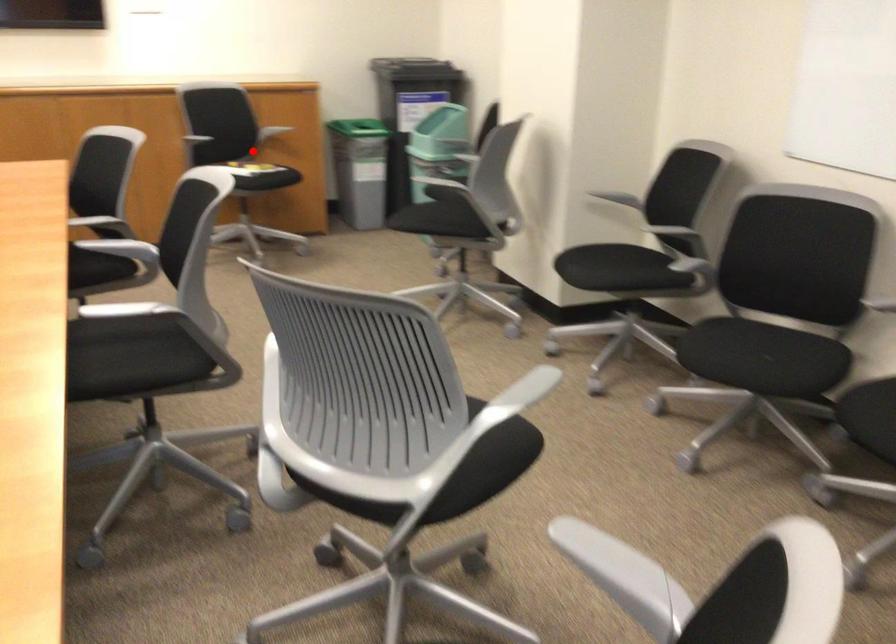
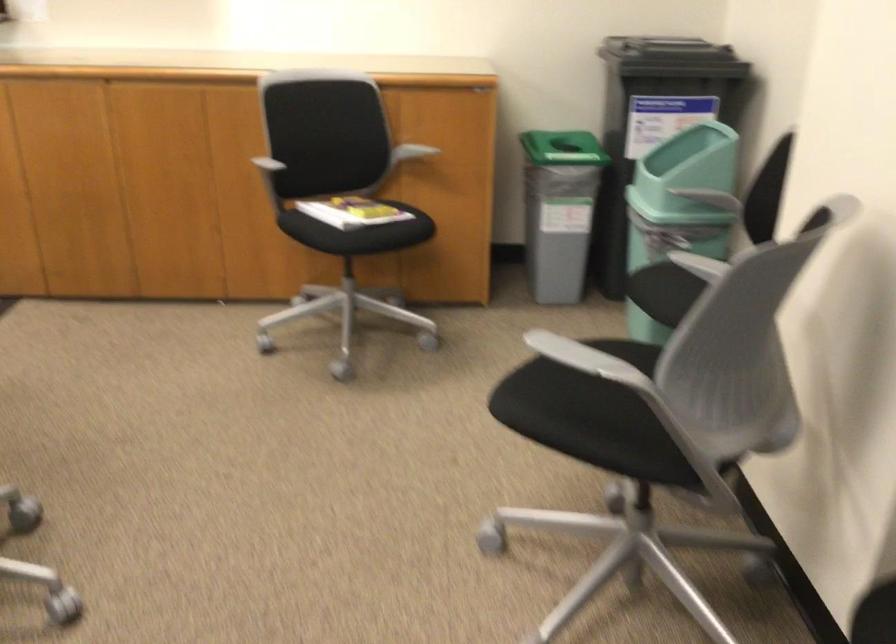
Question: I am providing you with two images of the same scene from different viewpoints. Given a red point in image1, look at the same physical point in image2. Is it:

Choices:
 (A) Closer to the viewpoint
 (B) Farther from the viewpoint

Answer: (A)